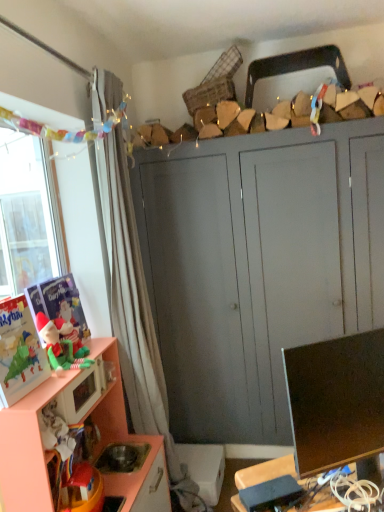
What do you see at coordinates (131, 298) in the screenshot? The image size is (384, 512). I see `white sheer curtain at left` at bounding box center [131, 298].

Describe the element at coordinates (62, 344) in the screenshot. The height and width of the screenshot is (512, 384). I see `matte green plush elf at left, arranged as the second toy when viewed from the back` at that location.

Image resolution: width=384 pixels, height=512 pixels. What do you see at coordinates (82, 392) in the screenshot? I see `matte pink microwave at lower left` at bounding box center [82, 392].

Identify the location of matte black monitor at lower right. Image resolution: width=384 pixels, height=512 pixels. (336, 401).

Describe the element at coordinates (71, 337) in the screenshot. I see `matte plastic toy at left, placed as the first toy when sorted from back to front` at that location.

The height and width of the screenshot is (512, 384). What are the coordinates of `white sheer curtain at left` in the screenshot? It's located at (131, 298).

Could you tell me if peach wood cabinet at lower left, positioned as the second cabinetry in back-to-front order, is facing matte green plush elf at left, arranged as the second toy when viewed from the back?

No, peach wood cabinet at lower left, positioned as the second cabinetry in back-to-front order, does not turn towards matte green plush elf at left, arranged as the second toy when viewed from the back.

Is peach wood cabinet at lower left, the first cabinetry viewed from the front, to the left or to the right of matte green plush elf at left, acting as the first toy starting from the front, in the image?

peach wood cabinet at lower left, the first cabinetry viewed from the front, is positioned on matte green plush elf at left, acting as the first toy starting from the front,'s right side.

Between peach wood cabinet at lower left, positioned as the second cabinetry in back-to-front order, and matte green plush elf at left, acting as the first toy starting from the front, which one has larger size?

With larger size is peach wood cabinet at lower left, positioned as the second cabinetry in back-to-front order.

Is the position of white sheer curtain at left less distant than that of peach wood cabinet at lower left, the first cabinetry viewed from the front?

No, white sheer curtain at left is further to the viewer.

Considering the sizes of objects white sheer curtain at left and peach wood cabinet at lower left, positioned as the second cabinetry in back-to-front order, in the image provided, who is smaller, white sheer curtain at left or peach wood cabinet at lower left, positioned as the second cabinetry in back-to-front order,?

With smaller size is white sheer curtain at left.

Is white sheer curtain at left facing away from peach wood cabinet at lower left, the first cabinetry viewed from the front?

That's not correct — white sheer curtain at left is not looking away from peach wood cabinet at lower left, the first cabinetry viewed from the front.

Measure the distance from white sheer curtain at left to peach wood cabinet at lower left, the first cabinetry viewed from the front.

They are 12.11 inches apart.

Considering the sizes of objects matte gray cabinet at center, the second cabinetry from the front, and matte black monitor at lower right in the image provided, who is wider, matte gray cabinet at center, the second cabinetry from the front, or matte black monitor at lower right?

matte gray cabinet at center, the second cabinetry from the front.

From a real-world perspective, relative to matte black monitor at lower right, is matte gray cabinet at center, which is counted as the 1th cabinetry, starting from the back, vertically above or below?

Clearly, from a real-world perspective, matte gray cabinet at center, which is counted as the 1th cabinetry, starting from the back, is below matte black monitor at lower right.

Which is in front, point (209, 368) or point (305, 361)?

Point (305, 361)

Considering the positions of objects matte green plush elf at left, acting as the first toy starting from the front, and matte black monitor at lower right in the image provided, who is in front, matte green plush elf at left, acting as the first toy starting from the front, or matte black monitor at lower right?

matte black monitor at lower right.

Is matte black monitor at lower right at the back of matte green plush elf at left, acting as the first toy starting from the front?

No, matte black monitor at lower right is not at the back of matte green plush elf at left, acting as the first toy starting from the front.

Considering the relative sizes of matte green plush elf at left, arranged as the second toy when viewed from the back, and matte black monitor at lower right in the image provided, is matte green plush elf at left, arranged as the second toy when viewed from the back, shorter than matte black monitor at lower right?

Yes, matte green plush elf at left, arranged as the second toy when viewed from the back, is shorter than matte black monitor at lower right.

Is matte green plush elf at left, arranged as the second toy when viewed from the back, situated inside matte black monitor at lower right or outside?

The correct answer is: outside.

From a real-world perspective, is white sheer curtain at left beneath matte green plush elf at left, acting as the first toy starting from the front?

Incorrect, from a real-world perspective, white sheer curtain at left is higher than matte green plush elf at left, acting as the first toy starting from the front.

Would you say white sheer curtain at left is to the left or to the right of matte green plush elf at left, arranged as the second toy when viewed from the back, in the picture?

Based on their positions, white sheer curtain at left is located to the right of matte green plush elf at left, arranged as the second toy when viewed from the back.

What's the angular difference between white sheer curtain at left and matte green plush elf at left, arranged as the second toy when viewed from the back,'s facing directions?

white sheer curtain at left and matte green plush elf at left, arranged as the second toy when viewed from the back, are facing 0.00102 degrees away from each other.

Considering the relative sizes of white sheer curtain at left and matte green plush elf at left, arranged as the second toy when viewed from the back, in the image provided, is white sheer curtain at left shorter than matte green plush elf at left, arranged as the second toy when viewed from the back,?

No.

From a real-world perspective, is matte plastic toy at left, the 2th toy in the front-to-back sequence, positioned above or below matte pink microwave at lower left?

Clearly, from a real-world perspective, matte plastic toy at left, the 2th toy in the front-to-back sequence, is above matte pink microwave at lower left.

Is matte pink microwave at lower left located within matte plastic toy at left, placed as the first toy when sorted from back to front?

No.

Is matte plastic toy at left, the 2th toy in the front-to-back sequence, to the right of matte pink microwave at lower left from the viewer's perspective?

No.

Which of these two, matte black monitor at lower right or white sheer curtain at left, is thinner?

matte black monitor at lower right is thinner.

Who is smaller, matte black monitor at lower right or white sheer curtain at left?

matte black monitor at lower right.

Where is `television in front of the white sheer curtain at left`? television in front of the white sheer curtain at left is located at coordinates (336, 401).

From the peach wood cabinet at lower left, the first cabinetry viewed from the front, count 1st toys backward and point to it. Please provide its 2D coordinates.

[(62, 344)]

There is a peach wood cabinet at lower left, positioned as the second cabinetry in back-to-front order. Where is `curtain above it (from a real-world perspective)`? This screenshot has width=384, height=512. curtain above it (from a real-world perspective) is located at coordinates (131, 298).

Looking at the image, which one is located further to white sheer curtain at left, matte black monitor at lower right or matte green plush elf at left, arranged as the second toy when viewed from the back?

Among the two, matte black monitor at lower right is located further to white sheer curtain at left.

Looking at the image, which one is located closer to matte green plush elf at left, arranged as the second toy when viewed from the back, peach wood cabinet at lower left, positioned as the second cabinetry in back-to-front order, or white sheer curtain at left?

peach wood cabinet at lower left, positioned as the second cabinetry in back-to-front order, is closer to matte green plush elf at left, arranged as the second toy when viewed from the back.

Estimate the real-world distances between objects in this image. Which object is closer to matte green plush elf at left, acting as the first toy starting from the front, matte gray cabinet at center, the second cabinetry from the front, or white sheer curtain at left?

white sheer curtain at left.

Looking at this image, considering their positions, is matte plastic toy at left, the 2th toy in the front-to-back sequence, positioned further to matte green plush elf at left, acting as the first toy starting from the front, than matte gray cabinet at center, the second cabinetry from the front?

matte gray cabinet at center, the second cabinetry from the front, is further to matte green plush elf at left, acting as the first toy starting from the front.

When comparing their distances from matte pink microwave at lower left, does matte black monitor at lower right or white sheer curtain at left seem closer?

Among the two, white sheer curtain at left is located nearer to matte pink microwave at lower left.

Which object lies further to the anchor point matte plastic toy at left, the 2th toy in the front-to-back sequence, white sheer curtain at left or matte green plush elf at left, acting as the first toy starting from the front?

white sheer curtain at left.

When comparing their distances from peach wood cabinet at lower left, the first cabinetry viewed from the front, does matte gray cabinet at center, which is counted as the 1th cabinetry, starting from the back, or matte black monitor at lower right seem closer?

Based on the image, matte gray cabinet at center, which is counted as the 1th cabinetry, starting from the back, appears to be nearer to peach wood cabinet at lower left, the first cabinetry viewed from the front.

Which object lies further to the anchor point matte gray cabinet at center, which is counted as the 1th cabinetry, starting from the back, matte pink microwave at lower left or peach wood cabinet at lower left, the first cabinetry viewed from the front?

The object further to matte gray cabinet at center, which is counted as the 1th cabinetry, starting from the back, is matte pink microwave at lower left.

At what (x,y) coordinates should I click in order to perform the action: click on curtain situated between matte plastic toy at left, placed as the first toy when sorted from back to front, and matte gray cabinet at center, the second cabinetry from the front, from left to right. Please return your answer as a coordinate pair (x, y). The height and width of the screenshot is (512, 384). Looking at the image, I should click on [131, 298].

Where is `cabinetry located between matte plastic toy at left, placed as the first toy when sorted from back to front, and matte black monitor at lower right in the left-right direction`? The width and height of the screenshot is (384, 512). cabinetry located between matte plastic toy at left, placed as the first toy when sorted from back to front, and matte black monitor at lower right in the left-right direction is located at coordinates (127, 442).

Locate an element on the screen. The image size is (384, 512). microwave oven situated between matte plastic toy at left, placed as the first toy when sorted from back to front, and matte black monitor at lower right from left to right is located at coordinates (82, 392).

Where is `microwave oven that lies between matte plastic toy at left, the 2th toy in the front-to-back sequence, and peach wood cabinet at lower left, the first cabinetry viewed from the front, from top to bottom`? The width and height of the screenshot is (384, 512). microwave oven that lies between matte plastic toy at left, the 2th toy in the front-to-back sequence, and peach wood cabinet at lower left, the first cabinetry viewed from the front, from top to bottom is located at coordinates (82, 392).